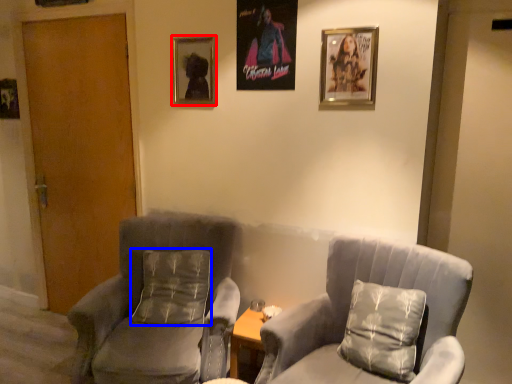
Question: Among these objects, which one is farthest to the camera, picture frame (highlighted by a red box) or pillow (highlighted by a blue box)?

Choices:
 (A) picture frame
 (B) pillow

Answer: (A)